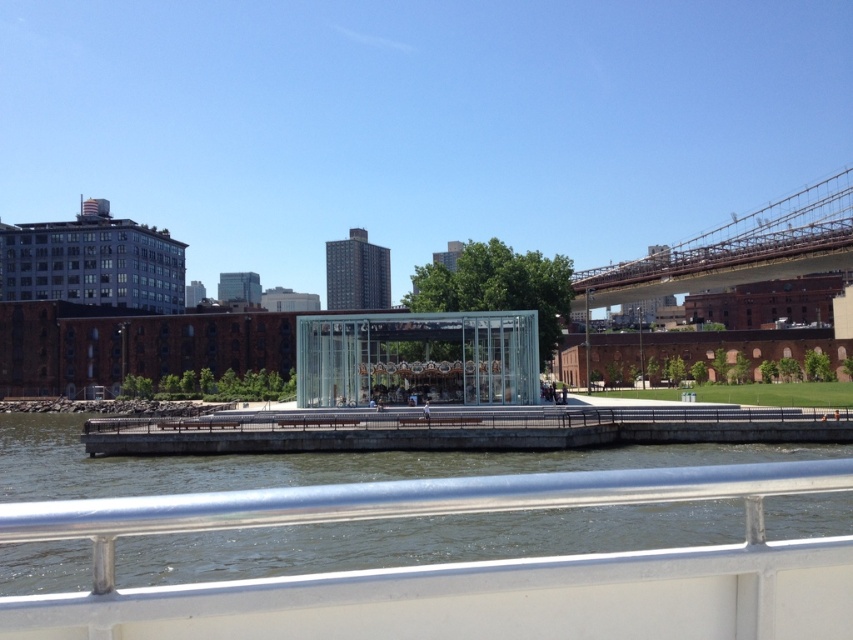
Question: Which object is positioned farthest from the brown wooden bridge at upper right?

Choices:
 (A) greenish water at lower center
 (B) metallic gray rail at center
 (C) transparent glass carousel at center

Answer: (A)

Question: Based on their relative distances, which object is nearer to the greenish water at lower center?

Choices:
 (A) brown wooden bridge at upper right
 (B) transparent glass carousel at center

Answer: (B)

Question: Does metallic gray rail at center appear over transparent glass carousel at center?

Choices:
 (A) yes
 (B) no

Answer: (B)

Question: Which of the following is the farthest from the observer?

Choices:
 (A) (49, 496)
 (B) (575, 291)

Answer: (B)

Question: Can you confirm if metallic gray rail at center is thinner than transparent glass carousel at center?

Choices:
 (A) yes
 (B) no

Answer: (B)

Question: Is transparent glass carousel at center positioned at the back of brown wooden bridge at upper right?

Choices:
 (A) no
 (B) yes

Answer: (A)